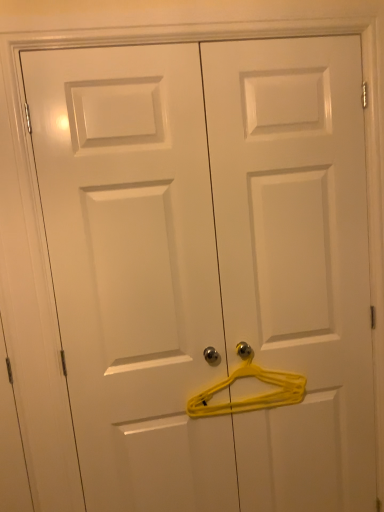
Measure the distance between point (233, 377) and camera.

4.84 feet.

At what (x,y) coordinates should I click in order to perform the action: click on yellow plastic hanger at center. Please return your answer as a coordinate pair (x, y). This screenshot has width=384, height=512. Looking at the image, I should click on (251, 397).

Describe the element at coordinates (251, 397) in the screenshot. The image size is (384, 512). I see `yellow plastic hanger at center` at that location.

Find the location of a particular element. The width and height of the screenshot is (384, 512). yellow plastic hanger at center is located at coordinates (251, 397).